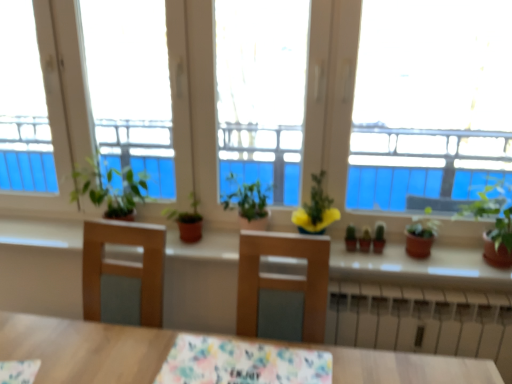
You are a GUI agent. You are given a task and a screenshot of the screen. Output one action in this format:
    pyautogui.click(x=<x>, y=<y>)
    Task: Click on the free space to the left of green matte plant at center, placed as the second houseplant when sorted from left to right
    The width and height of the screenshot is (512, 384).
    Given the screenshot: What is the action you would take?
    pyautogui.click(x=207, y=241)